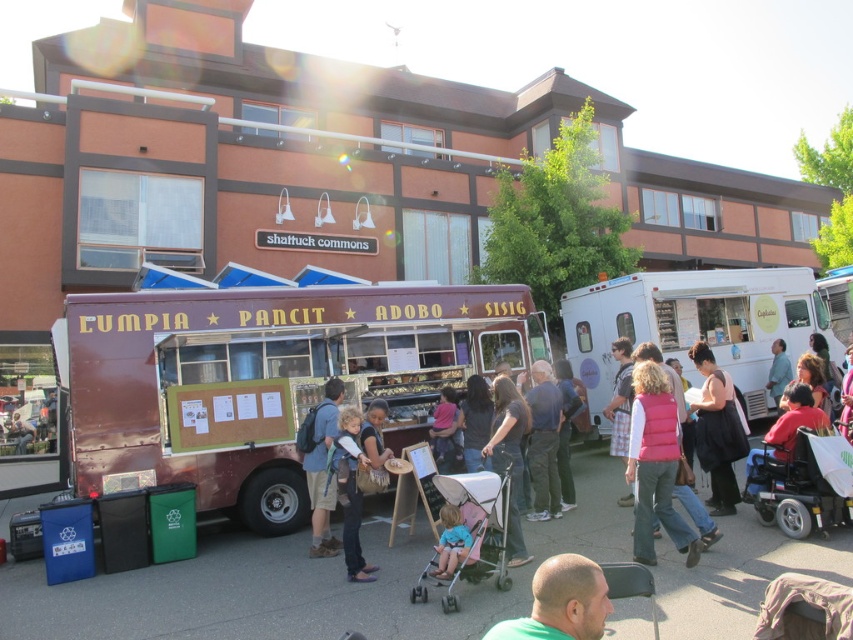
Question: Is white glossy food truck at right thinner than light blue shirt at center?

Choices:
 (A) no
 (B) yes

Answer: (A)

Question: Which object is positioned farthest from the brown matte food truck at center?

Choices:
 (A) denim shorts at center
 (B) pink puffer vest at center

Answer: (B)

Question: Which point is farther from the camera taking this photo?

Choices:
 (A) (718, 497)
 (B) (454, 561)
 (C) (444, 472)
 (D) (463, 520)

Answer: (C)

Question: Based on their relative distances, which object is farther from the denim shorts at center?

Choices:
 (A) pink puffer vest at center
 (B) light blue shirt at center

Answer: (B)

Question: Does denim shorts at center appear under pink fabric shirt at center?

Choices:
 (A) yes
 (B) no

Answer: (A)

Question: Can you confirm if pink fabric baby carriage at center is positioned to the right of matte pink sweater at center?

Choices:
 (A) yes
 (B) no

Answer: (B)